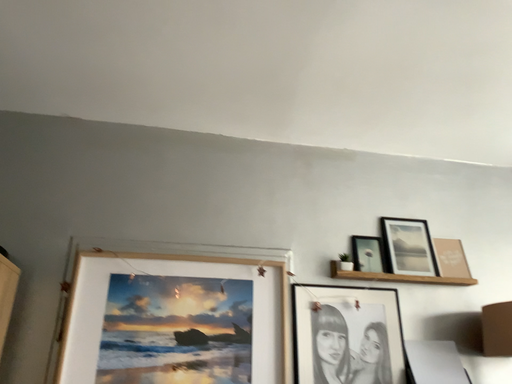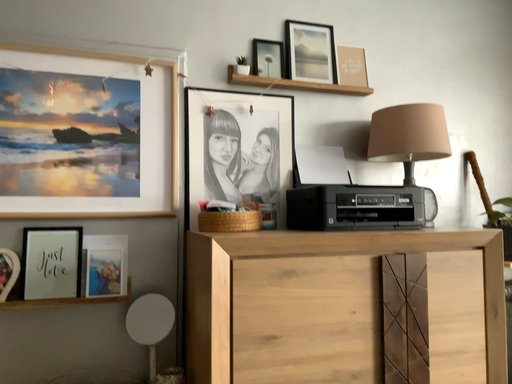
Question: Which way did the camera rotate in the video?

Choices:
 (A) rotated right
 (B) rotated left

Answer: (A)